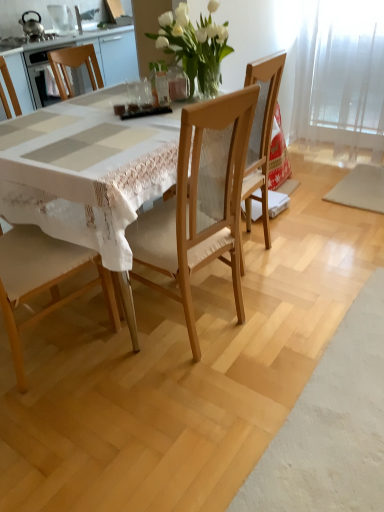
Image resolution: width=384 pixels, height=512 pixels. I want to click on vacant area that is in front of wooden chair at center, positioned as the 2th chair in left-to-right order, so click(259, 285).